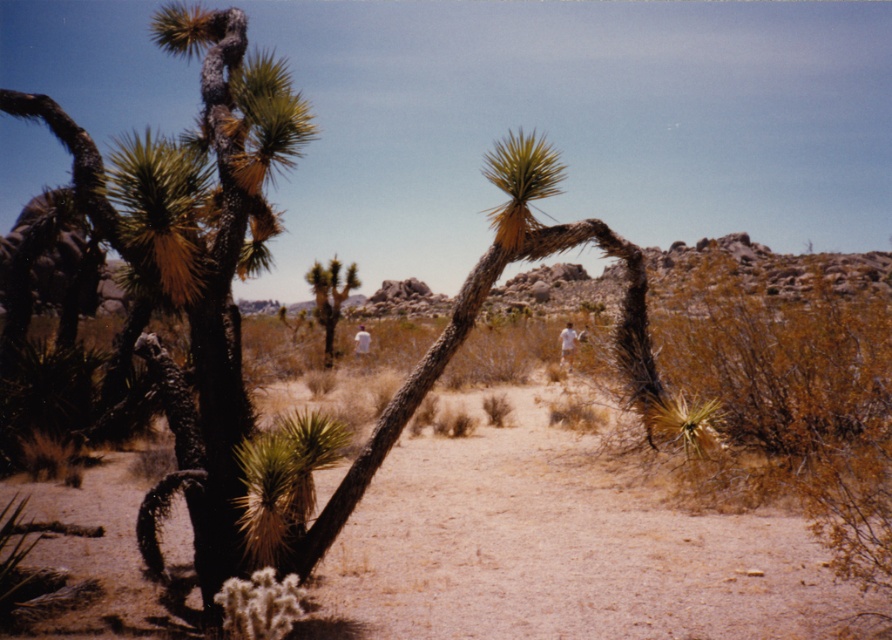
You are standing at the point marked by the coordinates point (562, 550) in the desert scene. Looking around, you see the brown sandy ground at center. What is the most prominent natural feature directly behind you?

The most prominent natural feature directly behind you would be the rocky background, as the point (562, 550) marks the brown sandy ground at center, which is in the foreground of the desert landscape.

You are standing in the desert scene and want to walk towards the green spiky cactus at center. Which direction should you face to move directly towards it from the brown sandy ground at center?

You should face to the left to move directly towards the green spiky cactus at center since the brown sandy ground at center is to its right.